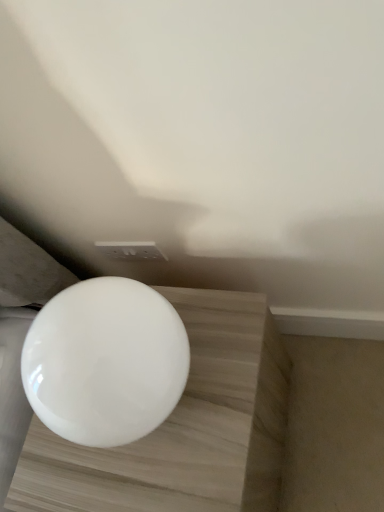
Question: From a real-world perspective, relative to white glossy sphere at center, is white glossy toilet at center vertically above or below?

Choices:
 (A) above
 (B) below

Answer: (A)

Question: Considering their positions, is white glossy toilet at center located in front of or behind white glossy sphere at center?

Choices:
 (A) front
 (B) behind

Answer: (A)

Question: Visually, is white glossy toilet at center positioned to the left or to the right of white glossy sphere at center?

Choices:
 (A) right
 (B) left

Answer: (B)

Question: From the image's perspective, is white glossy sphere at center positioned above or below white glossy toilet at center?

Choices:
 (A) below
 (B) above

Answer: (A)

Question: Considering the positions of white glossy sphere at center and white glossy toilet at center in the image, is white glossy sphere at center taller or shorter than white glossy toilet at center?

Choices:
 (A) short
 (B) tall

Answer: (B)

Question: In the image, is white glossy sphere at center positioned in front of or behind white glossy toilet at center?

Choices:
 (A) front
 (B) behind

Answer: (B)

Question: Is point (249, 437) closer or farther from the camera than point (170, 407)?

Choices:
 (A) closer
 (B) farther

Answer: (B)